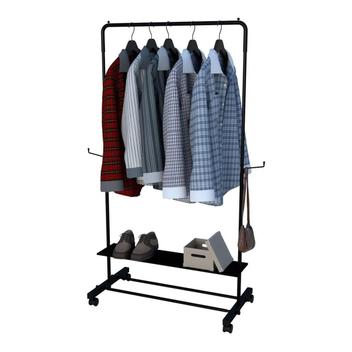
Identify the location of hanger. (221, 44), (192, 46), (168, 45), (152, 43), (131, 45).